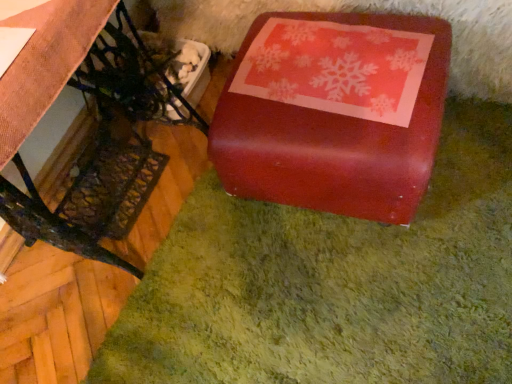
At what (x,y) coordinates should I click in order to perform the action: click on glossy red box at center. Please return your answer as a coordinate pair (x, y). This screenshot has height=384, width=512. Looking at the image, I should click on (334, 112).

What do you see at coordinates (334, 112) in the screenshot?
I see `glossy red box at center` at bounding box center [334, 112].

Measure the distance between shiny red box at right and camera.

The distance of shiny red box at right from camera is 1.07 meters.

Identify the location of shiny red box at right. (109, 145).

Describe the element at coordinates (109, 145) in the screenshot. The image size is (512, 384). I see `shiny red box at right` at that location.

What are the coordinates of `glossy red box at center` in the screenshot? It's located at (334, 112).

Which is more to the right, glossy red box at center or shiny red box at right?

glossy red box at center.

Which object is closer to the camera, glossy red box at center or shiny red box at right?

Positioned in front is shiny red box at right.

Does point (356, 90) come behind point (32, 216)?

That is False.

From the image's perspective, is glossy red box at center above or below shiny red box at right?

Clearly, from the image's perspective, glossy red box at center is above shiny red box at right.

From a real-world perspective, is glossy red box at center above or below shiny red box at right?

Clearly, from a real-world perspective, glossy red box at center is below shiny red box at right.

Can you confirm if glossy red box at center is thinner than shiny red box at right?

In fact, glossy red box at center might be wider than shiny red box at right.

Is glossy red box at center taller or shorter than shiny red box at right?

glossy red box at center is shorter than shiny red box at right.

Between glossy red box at center and shiny red box at right, which one has smaller size?

glossy red box at center is smaller.

Is glossy red box at center not within shiny red box at right?

Yes, glossy red box at center is outside of shiny red box at right.

Is glossy red box at center touching shiny red box at right?

glossy red box at center and shiny red box at right are clearly separated.

Is shiny red box at right at the back of glossy red box at center?

No, glossy red box at center is not facing the opposite direction of shiny red box at right.

How far apart are glossy red box at center and shiny red box at right?

glossy red box at center and shiny red box at right are 21.61 inches apart from each other.

The height and width of the screenshot is (384, 512). Find the location of `furniture located below the glossy red box at center (from the image's perspective)`. furniture located below the glossy red box at center (from the image's perspective) is located at coordinates (109, 145).

Which is more to the left, shiny red box at right or glossy red box at center?

shiny red box at right.

Based on the photo, considering their positions, is shiny red box at right located in front of or behind glossy red box at center?

Clearly, shiny red box at right is in front of glossy red box at center.

Is point (32, 221) farther from camera compared to point (266, 27)?

Yes, point (32, 221) is behind point (266, 27).

From the image's perspective, which one is positioned lower, shiny red box at right or glossy red box at center?

shiny red box at right.

From a real-world perspective, who is located lower, shiny red box at right or glossy red box at center?

In real-world perspective, glossy red box at center is lower.

Between shiny red box at right and glossy red box at center, which one has smaller width?

shiny red box at right is thinner.

Between shiny red box at right and glossy red box at center, which one has more height?

Result: shiny red box at right is taller.

Looking at the image, does shiny red box at right seem bigger or smaller compared to glossy red box at center?

In the image, shiny red box at right appears to be larger than glossy red box at center.

Is shiny red box at right completely or partially outside of glossy red box at center?

Yes.

Is shiny red box at right positioned far away from glossy red box at center?

Actually, shiny red box at right and glossy red box at center are a little close together.

Is glossy red box at center at the back of shiny red box at right?

No.

How many degrees apart are the facing directions of shiny red box at right and glossy red box at center?

88.1 degrees separate the facing orientations of shiny red box at right and glossy red box at center.

At what (x,y) coordinates should I click in order to perform the action: click on furniture lying below the glossy red box at center (from the image's perspective). Please return your answer as a coordinate pair (x, y). Looking at the image, I should click on pos(109,145).

I want to click on furniture on the left of glossy red box at center, so click(109, 145).

What are the coordinates of `table located behind the shiny red box at right` in the screenshot? It's located at (334, 112).